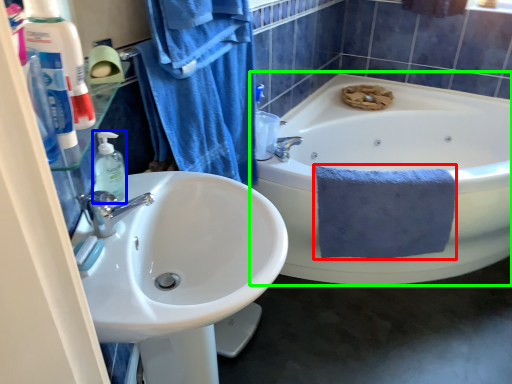
Question: Considering the real-world distances, which object is farthest from bath towel (highlighted by a red box)? soap dispenser (highlighted by a blue box) or bathtub (highlighted by a green box)?

Choices:
 (A) soap dispenser
 (B) bathtub

Answer: (A)